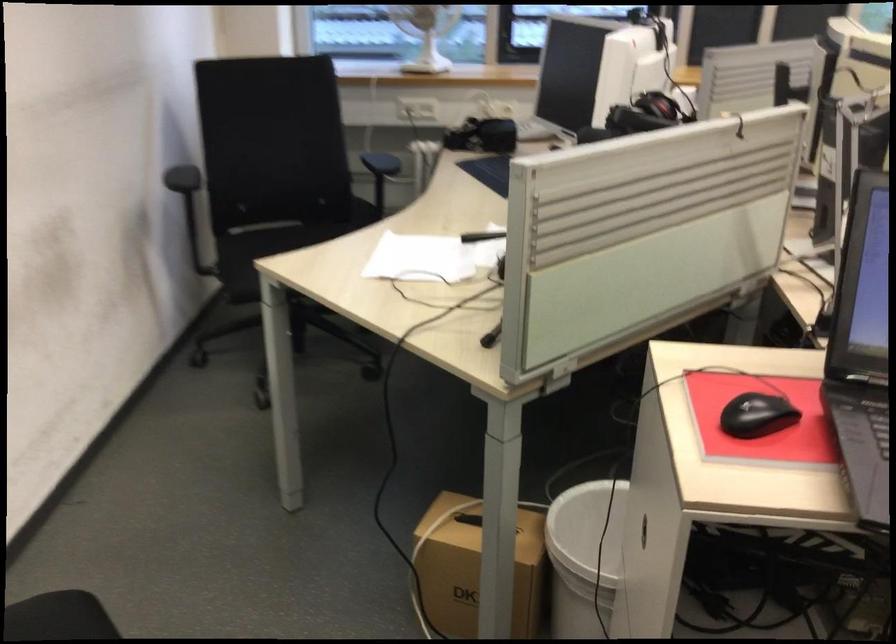
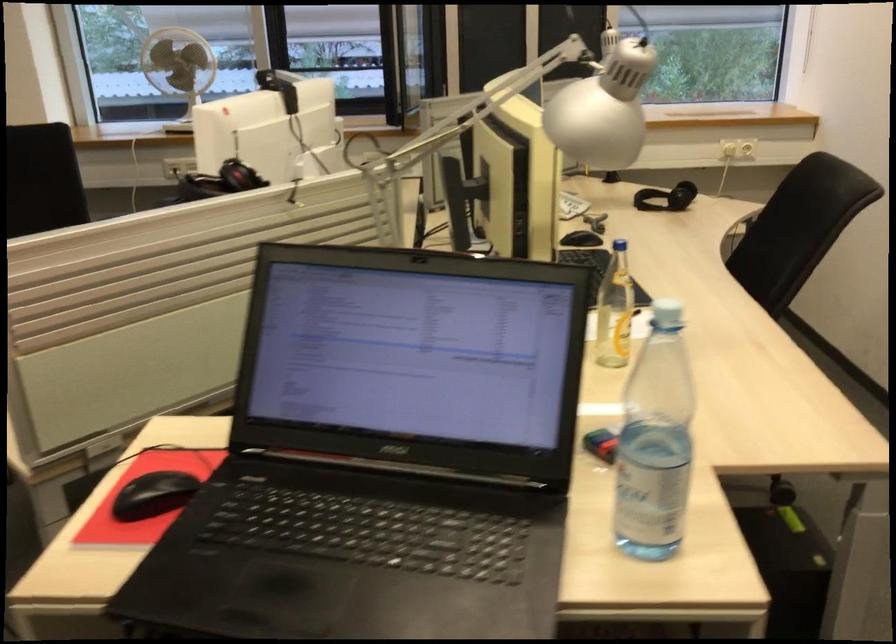
Question: In a continuous first-person perspective shot, in which direction is the camera moving?

Choices:
 (A) Left
 (B) Right
 (C) Forward
 (D) Backward

Answer: (B)